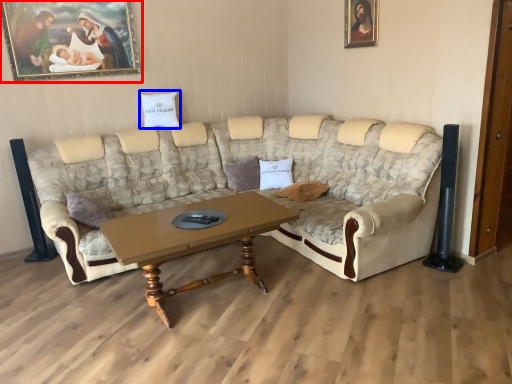
Question: Which of the following is the closest to the observer, picture frame (highlighted by a red box) or pillow (highlighted by a blue box)?

Choices:
 (A) picture frame
 (B) pillow

Answer: (A)